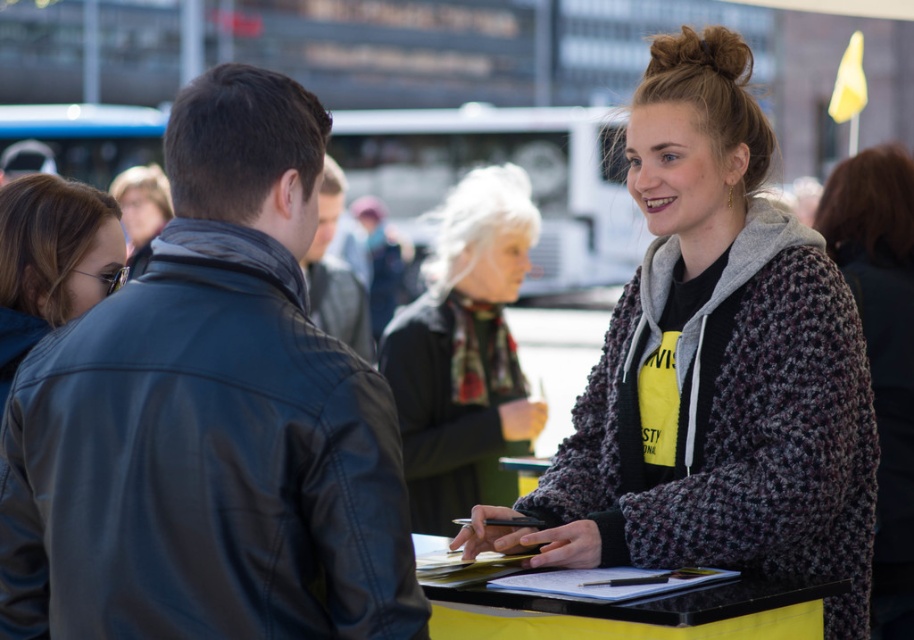
Does point (898, 268) come in front of point (342, 200)?

Yes, it is in front of point (342, 200).

The width and height of the screenshot is (914, 640). Describe the element at coordinates (881, 349) in the screenshot. I see `knitted gray sweater at center` at that location.

I want to click on knitted gray sweater at center, so click(881, 349).

Is the position of leather jacket at left less distant than that of knitted gray sweater at center?

Yes, leather jacket at left is in front of knitted gray sweater at center.

Which is more to the left, leather jacket at left or knitted gray sweater at center?

leather jacket at left is more to the left.

Between point (277, 364) and point (830, 182), which one is positioned in front?

Point (277, 364) is more forward.

The image size is (914, 640). Find the location of `leather jacket at left`. leather jacket at left is located at coordinates (210, 419).

Is knitted gray cardigan at center behind leather jacket at center?

No, it is not.

What do you see at coordinates (713, 368) in the screenshot? I see `knitted gray cardigan at center` at bounding box center [713, 368].

At what (x,y) coordinates should I click in order to perform the action: click on knitted gray cardigan at center. Please return your answer as a coordinate pair (x, y). This screenshot has width=914, height=640. Looking at the image, I should click on (713, 368).